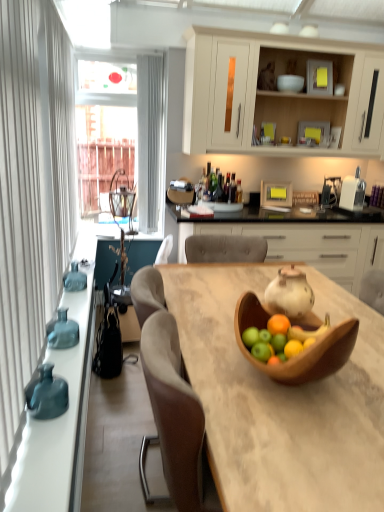
Question: From the image's perspective, is wooden bowl at center positioned above or below matte white teapot at center?

Choices:
 (A) below
 (B) above

Answer: (B)

Question: Looking at the image, does wooden bowl at center seem bigger or smaller compared to matte white teapot at center?

Choices:
 (A) small
 (B) big

Answer: (A)

Question: Which object is positioned farthest from the teal glass bottles at left?

Choices:
 (A) teal glass vase at left, marked as the 2th vase in a bottom-to-top arrangement
 (B) wooden bowl at center
 (C) matte blue vase at left, the third vase viewed from the back
 (D) teal glass vase at left
 (E) wooden table at center

Answer: (B)

Question: Estimate the real-world distances between objects in this image. Which object is farther from the teal glass vase at left?

Choices:
 (A) teal glass vase at left, which is counted as the 2th vase, starting from the back
 (B) matte white teapot at center
 (C) matte blue vase at left, which ranks as the 3th vase in top-to-bottom order
 (D) white matte cabinet at center, positioned as the 1th cabinetry in bottom-to-top order
 (E) wooden bowl at center

Answer: (D)